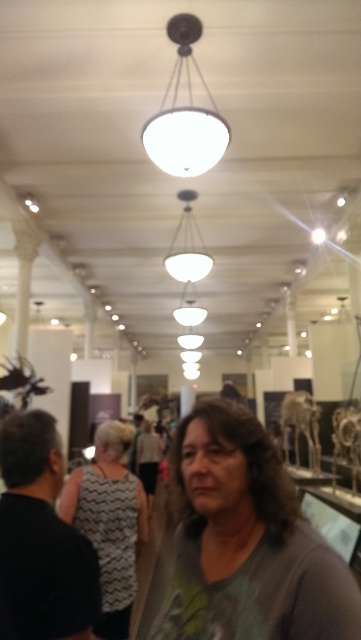
Question: Can you confirm if gray zigzag dress at center is positioned above white matte light fixture at upper center?

Choices:
 (A) no
 (B) yes

Answer: (A)

Question: Is gray zigzag dress at center to the left of white matte light fixture at upper center from the viewer's perspective?

Choices:
 (A) no
 (B) yes

Answer: (B)

Question: Which object is closer to the camera taking this photo?

Choices:
 (A) gray fabric at center
 (B) white matte light fixture at upper center
 (C) gray zigzag dress at center

Answer: (C)

Question: Which point is closer to the camera?

Choices:
 (A) (171, 548)
 (B) (185, 74)
 (C) (109, 541)

Answer: (C)

Question: Is gray fabric at center thinner than white matte light fixture at upper center?

Choices:
 (A) no
 (B) yes

Answer: (B)

Question: Which of the following is the closest to the observer?

Choices:
 (A) white matte light fixture at upper center
 (B) gray fabric at center

Answer: (A)